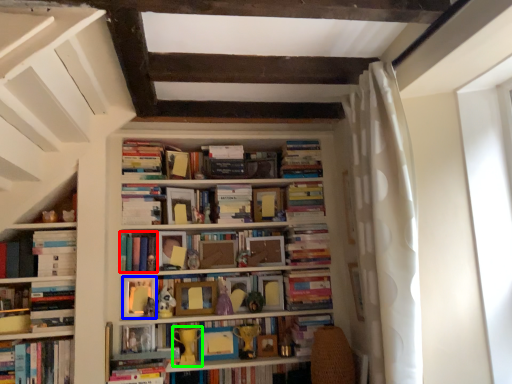
Question: Estimate the real-world distances between objects in this image. Which object is farther from book (highlighted by a red box), paperback book (highlighted by a blue box) or toy (highlighted by a green box)?

Choices:
 (A) paperback book
 (B) toy

Answer: (B)